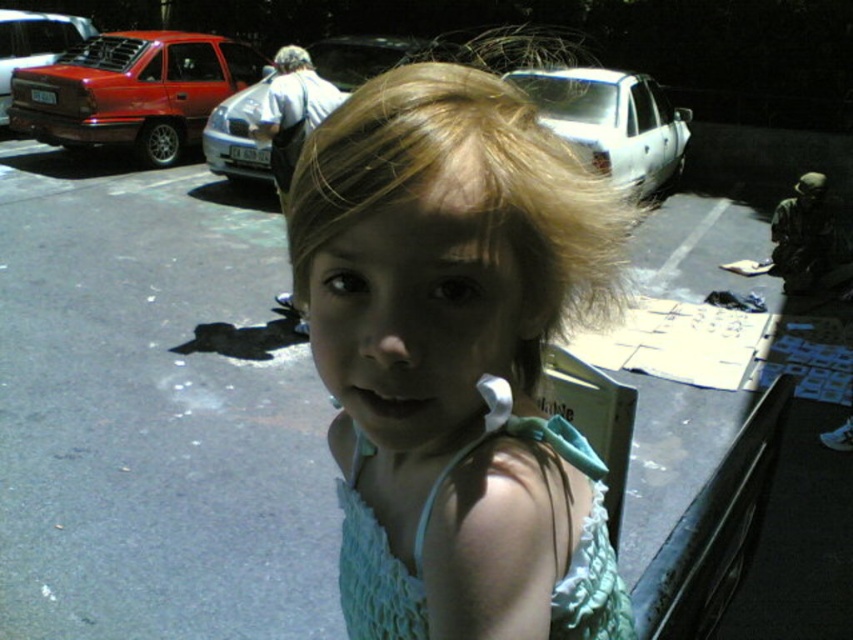
You are standing in the parking lot and want to locate the white glossy sedan at upper center. According to the coordinates provided, where would you find it?

The white glossy sedan at upper center is located at coordinates point 0.192 on the x axis and 0.719 on the y axis.